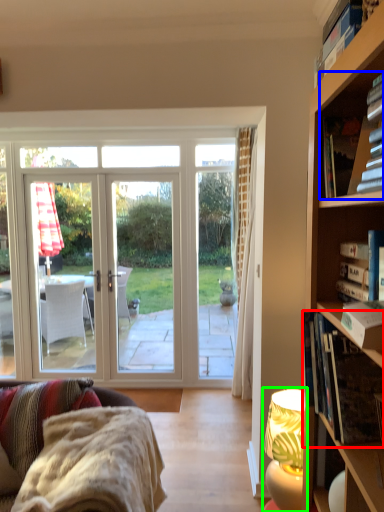
Question: Which object is the farthest from book (highlighted by a red box)? Choose among these: book (highlighted by a blue box) or lamp (highlighted by a green box).

Choices:
 (A) book
 (B) lamp

Answer: (A)